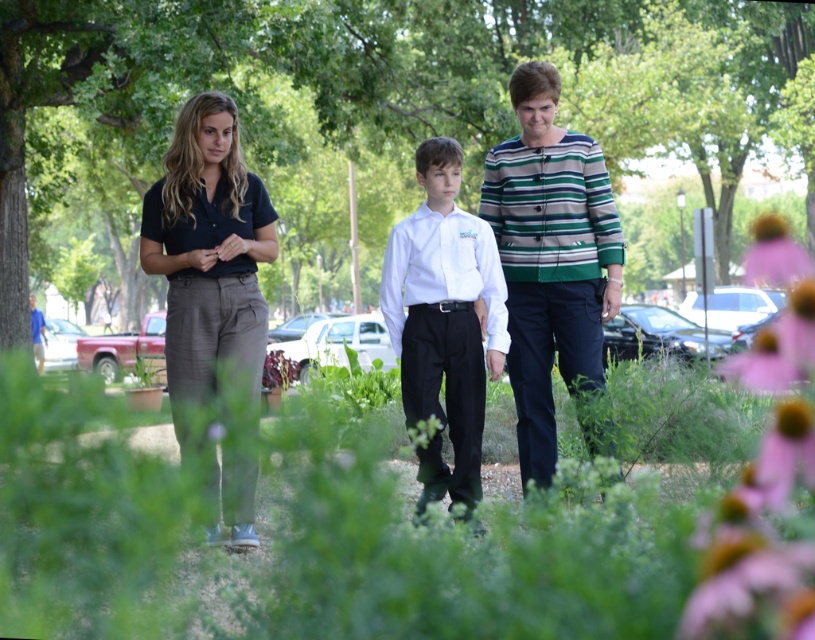
You are a photographer trying to capture a group photo of the striped cotton jacket at center and the dark blue cotton shirt at center. Since you want to ensure both are in focus, you need to know their positions relative to each other. According to the scene, which object is positioned to the right?

The striped cotton jacket at center is to the right of the dark blue cotton shirt at center, so the striped cotton jacket at center is positioned to the right.

You are a fashion designer observing the striped cotton jacket at center and the dark blue cotton shirt at center in the image. Which clothing item has a greater width when viewed from the front?

The striped cotton jacket at center has a greater width than the dark blue cotton shirt at center.